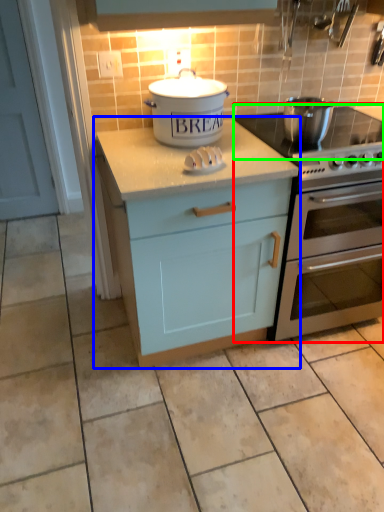
Question: Estimate the real-world distances between objects in this image. Which object is farther from oven (highlighted by a red box), cabinetry (highlighted by a blue box) or gas stove (highlighted by a green box)?

Choices:
 (A) cabinetry
 (B) gas stove

Answer: (B)